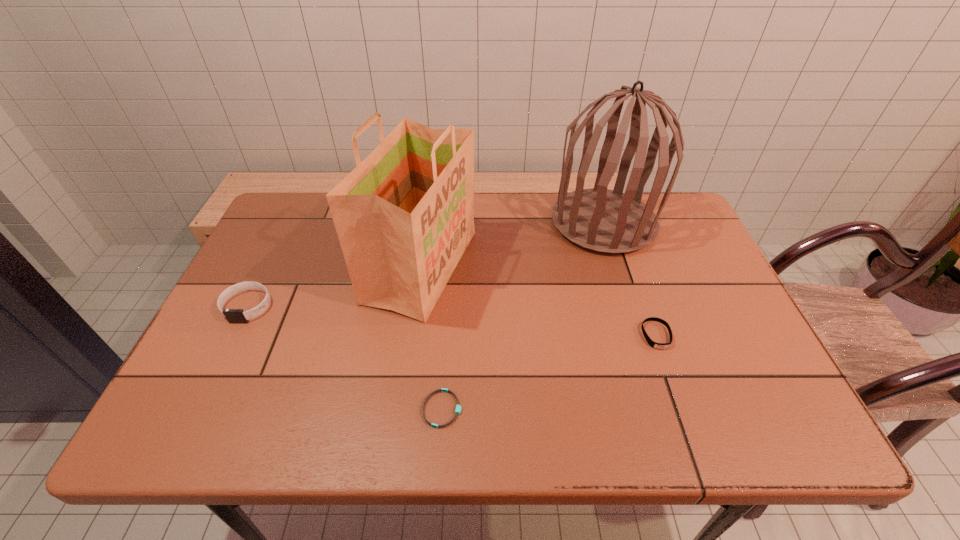
This screenshot has height=540, width=960. I want to click on vacant space at the near edge of the desktop, so click(x=473, y=408).

This screenshot has height=540, width=960. Find the location of `free spot at the left edge of the desktop`. free spot at the left edge of the desktop is located at coordinates (242, 359).

In order to click on vacant space at the right edge of the desktop in this screenshot , I will do `click(691, 271)`.

What are the coordinates of `free spot between the second wristband from right to left and the second shortest wristband` in the screenshot? It's located at (549, 372).

The height and width of the screenshot is (540, 960). In order to click on free space between the tallest wristband and the fourth tallest object in this screenshot , I will do `click(452, 321)`.

At what (x,y) coordinates should I click in order to perform the action: click on free space between the third shortest object and the rightmost wristband. Please return your answer as a coordinate pair (x, y). This screenshot has height=540, width=960. Looking at the image, I should click on (452, 321).

Where is `empty space that is in between the second wristband from right to left and the grocery bag`? Image resolution: width=960 pixels, height=540 pixels. empty space that is in between the second wristband from right to left and the grocery bag is located at coordinates (432, 338).

Locate an element on the screen. unoccupied position between the grocery bag and the second shortest object is located at coordinates (539, 301).

Identify the location of vacant area between the third tallest object and the rightmost wristband. (452, 321).

At what (x,y) coordinates should I click in order to perform the action: click on vacant space that's between the rightmost wristband and the birdcage. Please return your answer as a coordinate pair (x, y). Looking at the image, I should click on (630, 279).